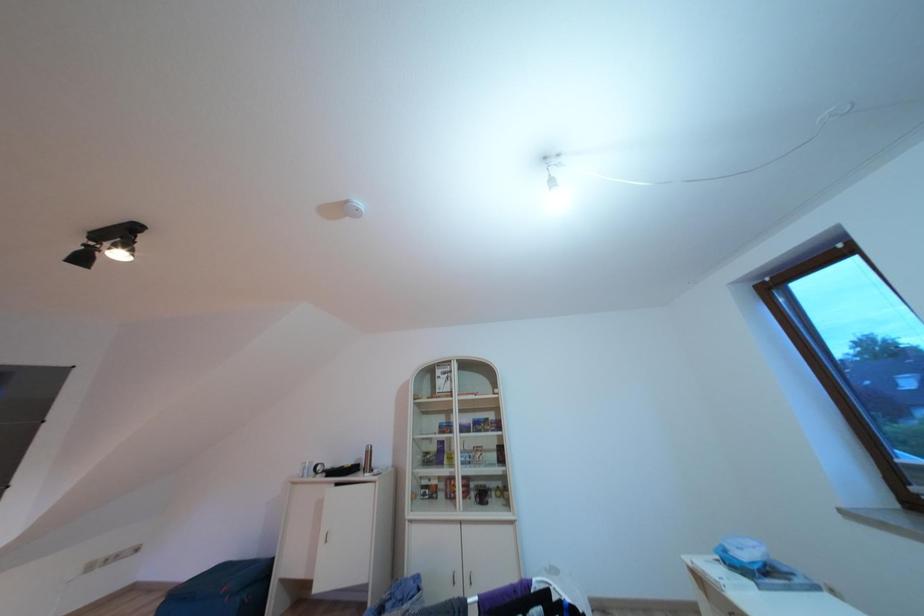
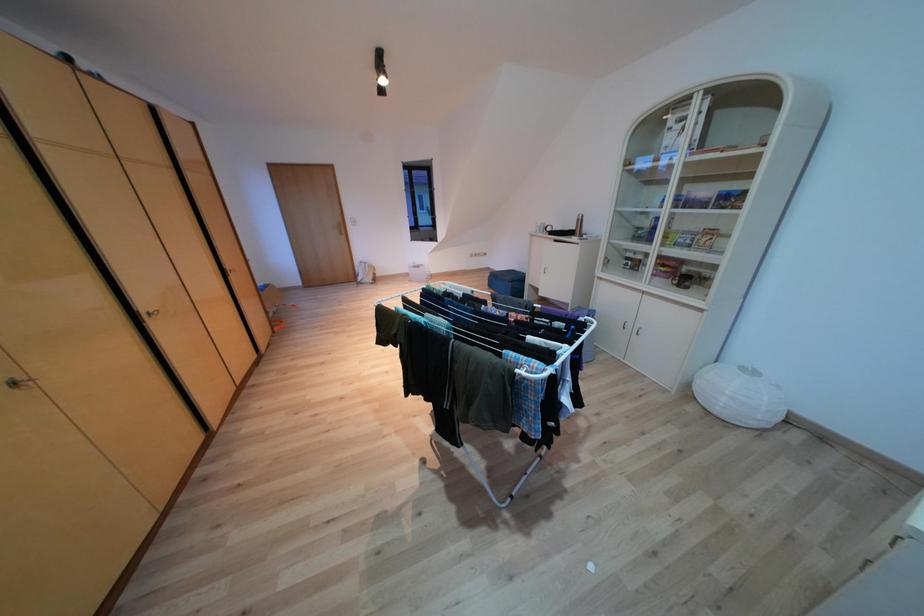
The images are taken continuously from a first-person perspective. In which direction is your viewpoint rotating?

The rotation direction of the camera is left-down.